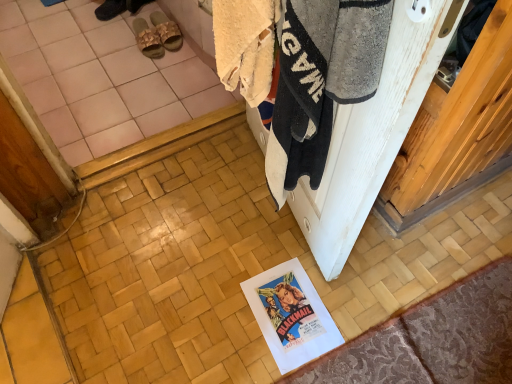
Image resolution: width=512 pixels, height=384 pixels. What are the coordinates of `vacant space in front of beige fabric slipper at upper left, which ranks as the second footwear in right-to-left order` in the screenshot? It's located at (139, 68).